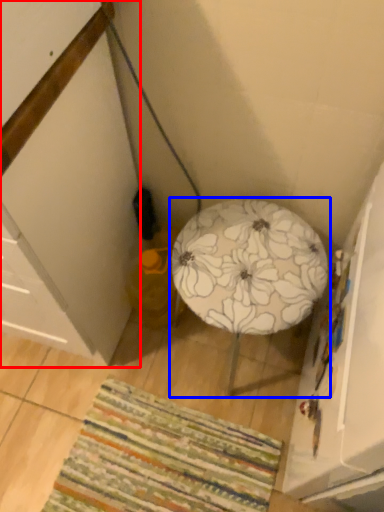
Question: Which object appears farthest to the camera in this image, cabinetry (highlighted by a red box) or furniture (highlighted by a blue box)?

Choices:
 (A) cabinetry
 (B) furniture

Answer: (B)